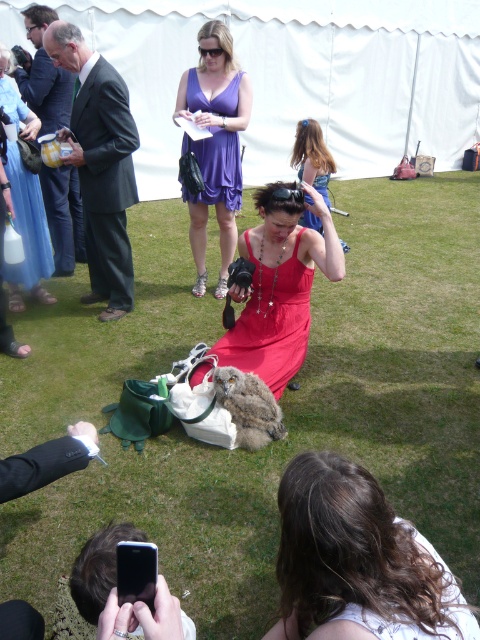
Question: Which point is farther to the camera?

Choices:
 (A) (x=297, y=140)
 (B) (x=228, y=349)
 (C) (x=217, y=403)
 (D) (x=466, y=200)

Answer: (D)

Question: Where is matte purple dress at center located in relation to red satin dress at center in the image?

Choices:
 (A) left
 (B) right

Answer: (A)

Question: Does purple satin dress at center have a greater width compared to matte red dress at center?

Choices:
 (A) yes
 (B) no

Answer: (B)

Question: Is fuzzy brown owl at center wider than matte purple dress at center?

Choices:
 (A) yes
 (B) no

Answer: (B)

Question: Which point is farther to the camera?

Choices:
 (A) fuzzy brown owl at center
 (B) matte purple dress at center

Answer: (B)

Question: Which object appears farthest from the camera in this image?

Choices:
 (A) purple satin dress at center
 (B) purple satin dress at upper center
 (C) matte purple dress at center

Answer: (C)